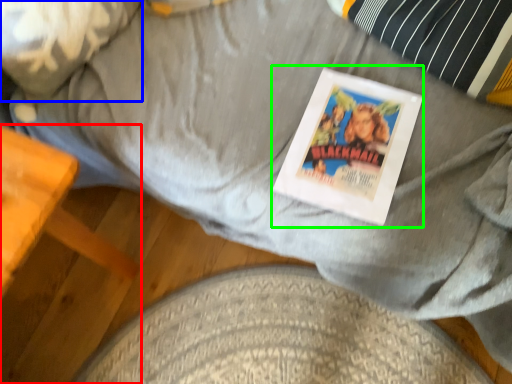
Question: Which object is the closest to the furniture (highlighted by a red box)? Choose among these: pillow (highlighted by a blue box) or magazine (highlighted by a green box).

Choices:
 (A) pillow
 (B) magazine

Answer: (A)